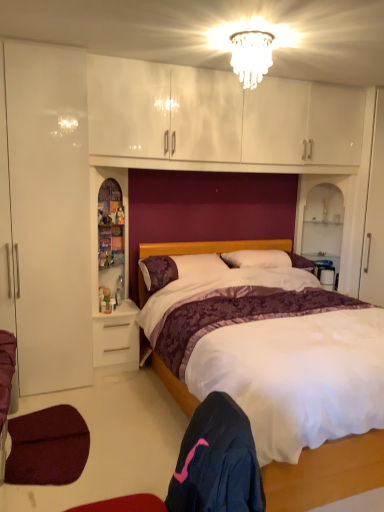
In order to face dark blue fabric at lower center, should I rotate leftwards or rightwards?

You should look right and rotate roughly 3.244 degrees.

You are a GUI agent. You are given a task and a screenshot of the screen. Output one action in this format:
    pyautogui.click(x=<x>, y=<y>)
    Task: Click on the wooden shelf at left
    
    Given the screenshot: What is the action you would take?
    pyautogui.click(x=97, y=224)

Describe the element at coordinates (266, 259) in the screenshot. I see `purple satin pillow at center, the first pillow viewed from the right` at that location.

This screenshot has width=384, height=512. In order to click on purple satin pillow at center, the first pillow viewed from the right in this screenshot , I will do `click(266, 259)`.

This screenshot has height=512, width=384. What do you see at coordinates (251, 56) in the screenshot?
I see `clear glass chandelier at upper center` at bounding box center [251, 56].

Measure the distance between point (118, 280) and camera.

Point (118, 280) and camera are 3.55 meters apart.

Locate an element on the screen. dark blue fabric at lower center is located at coordinates pos(217,462).

Considering the sizes of objects wooden shelf at left and dark blue fabric at lower center in the image provided, who is wider, wooden shelf at left or dark blue fabric at lower center?

wooden shelf at left is wider.

Is wooden shelf at left facing away from dark blue fabric at lower center?

wooden shelf at left is not turned away from dark blue fabric at lower center.

Is wooden shelf at left placed right next to dark blue fabric at lower center?

No, wooden shelf at left is not making contact with dark blue fabric at lower center.

Image resolution: width=384 pixels, height=512 pixels. I want to click on cabinet above the dark blue fabric at lower center (from the image's perspective), so click(x=97, y=224).

Between velvet dark red armchair at lower left and purple textured pillow at center, the 1th pillow in the left-to-right sequence, which one has more height?

With more height is velvet dark red armchair at lower left.

You are a GUI agent. You are given a task and a screenshot of the screen. Output one action in this format:
    pyautogui.click(x=<x>, y=<y>)
    Task: Click on the 1st pillow behind when counting from the velvet dark red armchair at lower left
    The width and height of the screenshot is (384, 512).
    Given the screenshot: What is the action you would take?
    177,268

Would you say purple textured pillow at center, the 2th pillow positioned from the right, is part of velvet dark red armchair at lower left's contents?

Definitely not — purple textured pillow at center, the 2th pillow positioned from the right, is not inside velvet dark red armchair at lower left.

In terms of size, does velvet dark red armchair at lower left appear bigger or smaller than purple textured pillow at center, the 2th pillow positioned from the right?

Clearly, velvet dark red armchair at lower left is larger in size than purple textured pillow at center, the 2th pillow positioned from the right.

Considering the points (116, 288) and (335, 449), which point is in front, point (116, 288) or point (335, 449)?

Point (335, 449)

From a real-world perspective, is translucent plastic bottle at left physically below white satin bed at center?

No, from a real-world perspective, translucent plastic bottle at left is not below white satin bed at center.

Does translucent plastic bottle at left have a greater height compared to white satin bed at center?

No, translucent plastic bottle at left is not taller than white satin bed at center.

Does translucent plastic bottle at left have a larger size compared to white satin bed at center?

No, translucent plastic bottle at left is not bigger than white satin bed at center.

Find the location of a particular element. the 2nd pillow behind when counting from the wooden shelf at left is located at coordinates click(266, 259).

Could you tell me if wooden shelf at left is facing purple satin pillow at center, the first pillow viewed from the right?

No, wooden shelf at left is not aimed at purple satin pillow at center, the first pillow viewed from the right.

Which object is wider, wooden shelf at left or purple satin pillow at center, the first pillow viewed from the right?

Wider between the two is purple satin pillow at center, the first pillow viewed from the right.

Is the surface of wooden shelf at left in direct contact with purple satin pillow at center, the first pillow viewed from the right?

No, wooden shelf at left is not with purple satin pillow at center, the first pillow viewed from the right.

Is translucent plastic bottle at left a part of purple satin pillow at center, acting as the 2th pillow starting from the left?

No, translucent plastic bottle at left is not inside purple satin pillow at center, acting as the 2th pillow starting from the left.

In the image, is purple satin pillow at center, the first pillow viewed from the right, positioned in front of or behind translucent plastic bottle at left?

In the image, purple satin pillow at center, the first pillow viewed from the right, appears in front of translucent plastic bottle at left.

Which of these two, purple satin pillow at center, the first pillow viewed from the right, or translucent plastic bottle at left, is wider?

Wider between the two is purple satin pillow at center, the first pillow viewed from the right.

From a real-world perspective, is white glossy drawer at lower left located higher than white satin bed at center?

Incorrect, from a real-world perspective, white glossy drawer at lower left is lower than white satin bed at center.

Find the location of a particular element. The width and height of the screenshot is (384, 512). bed that is on the right side of white glossy drawer at lower left is located at coordinates (326, 473).

Can you confirm if white glossy drawer at lower left is positioned to the left of white satin bed at center?

Yes.

From the picture: From the image's perspective, between white glossy drawer at lower left and white satin bed at center, who is located below?

white glossy drawer at lower left.

What's the angular difference between wooden shelf at left and white glossy drawer at lower left's facing directions?

wooden shelf at left and white glossy drawer at lower left are facing 0.000373 degrees away from each other.

Considering the sizes of objects wooden shelf at left and white glossy drawer at lower left in the image provided, who is shorter, wooden shelf at left or white glossy drawer at lower left?

white glossy drawer at lower left.

Considering the relative positions of wooden shelf at left and white glossy drawer at lower left in the image provided, is wooden shelf at left to the left of white glossy drawer at lower left from the viewer's perspective?

No.

From a real-world perspective, between wooden shelf at left and white glossy drawer at lower left, who is vertically lower?

From a 3D spatial view, white glossy drawer at lower left is below.

Where is `cabinet to the left of dark blue fabric at lower center`? This screenshot has width=384, height=512. cabinet to the left of dark blue fabric at lower center is located at coordinates (97, 224).

From the velvet dark red armchair at lower left, count 1st pillow to the right and point to it. Please provide its 2D coordinates.

[(177, 268)]

Which object lies further to the anchor point white glossy drawer at lower left, purple textured pillow at center, the 2th pillow positioned from the right, or dark blue fabric at lower center?

dark blue fabric at lower center.

Based on their spatial positions, is white satin bed at center or velvet dark red armchair at lower left closer to purple textured pillow at center, the 2th pillow positioned from the right?

The object closer to purple textured pillow at center, the 2th pillow positioned from the right, is white satin bed at center.

Considering their positions, is wooden shelf at left positioned closer to velvet dark red armchair at lower left than translucent plastic bottle at left?

Among the two, wooden shelf at left is located nearer to velvet dark red armchair at lower left.

From the image, which object appears to be nearer to dark blue fabric at lower center, velvet dark red armchair at lower left or clear glass chandelier at upper center?

velvet dark red armchair at lower left is positioned closer to the anchor dark blue fabric at lower center.

When comparing their distances from wooden shelf at left, does white glossy drawer at lower left or translucent plastic bottle at left seem closer?

translucent plastic bottle at left.

Which object lies nearer to the anchor point white satin bed at center, wooden shelf at left or dark blue fabric at lower center?

dark blue fabric at lower center is positioned closer to the anchor white satin bed at center.

Considering their positions, is purple textured pillow at center, the 2th pillow positioned from the right, positioned closer to white satin bed at center than translucent plastic bottle at left?

The object closer to white satin bed at center is purple textured pillow at center, the 2th pillow positioned from the right.

Based on their spatial positions, is purple satin pillow at center, the first pillow viewed from the right, or white satin bed at center further from purple textured pillow at center, the 1th pillow in the left-to-right sequence?

white satin bed at center is positioned further to the anchor purple textured pillow at center, the 1th pillow in the left-to-right sequence.

Locate an element on the screen. The height and width of the screenshot is (512, 384). cabinet positioned between white satin bed at center and purple satin pillow at center, the first pillow viewed from the right, from near to far is located at coordinates (97, 224).

Locate an element on the screen. This screenshot has height=512, width=384. desk between dark blue fabric at lower center and purple satin pillow at center, the first pillow viewed from the right, in the front-back direction is located at coordinates (116, 338).

Locate an element on the screen. bed positioned between velvet dark red armchair at lower left and purple satin pillow at center, the first pillow viewed from the right, from near to far is located at coordinates (326, 473).

Where is `lamp between velvet dark red armchair at lower left and white glossy drawer at lower left from front to back`? The width and height of the screenshot is (384, 512). lamp between velvet dark red armchair at lower left and white glossy drawer at lower left from front to back is located at coordinates (251, 56).